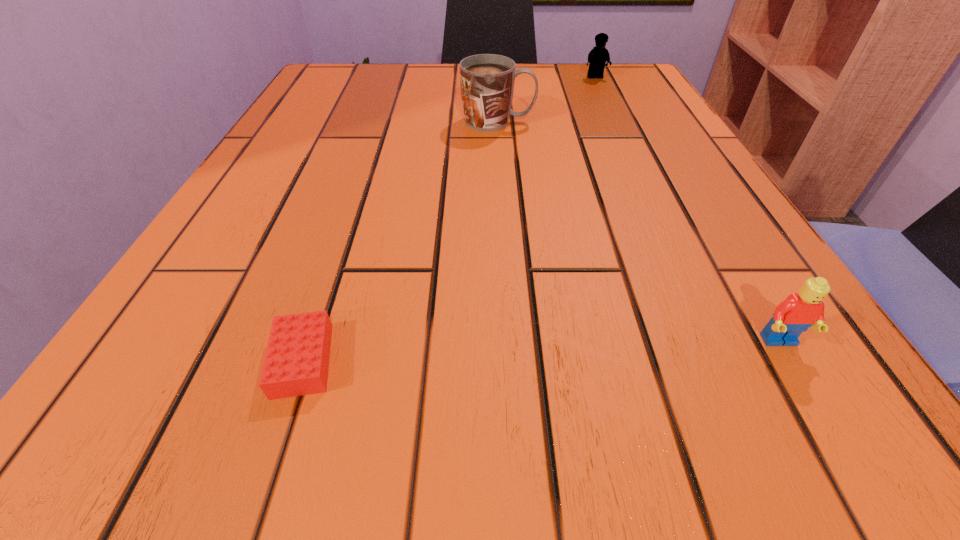
In order to click on the third object from right to left in this screenshot , I will do `click(487, 81)`.

Find the location of `mug`. mug is located at coordinates (487, 81).

You are a GUI agent. You are given a task and a screenshot of the screen. Output one action in this format:
    pyautogui.click(x=<x>, y=<y>)
    Task: Click on the farthest Lego
    The image size is (960, 540).
    Given the screenshot: What is the action you would take?
    pyautogui.click(x=598, y=56)

Identify the location of the third object from left to right. This screenshot has width=960, height=540. (598, 56).

In order to click on the rightmost object in this screenshot , I will do `click(799, 311)`.

The height and width of the screenshot is (540, 960). Find the location of `the shortest Lego`. the shortest Lego is located at coordinates (296, 363).

Where is `the leftmost Lego`? the leftmost Lego is located at coordinates (296, 363).

This screenshot has width=960, height=540. Find the location of `free space located 0.110m on the side of the mug with the handle`. free space located 0.110m on the side of the mug with the handle is located at coordinates (592, 122).

The height and width of the screenshot is (540, 960). I want to click on free space located on the front-facing side of the second Lego from right to left, so click(618, 126).

I want to click on vacant space positioned 0.110m on the face of the rightmost object, so click(846, 455).